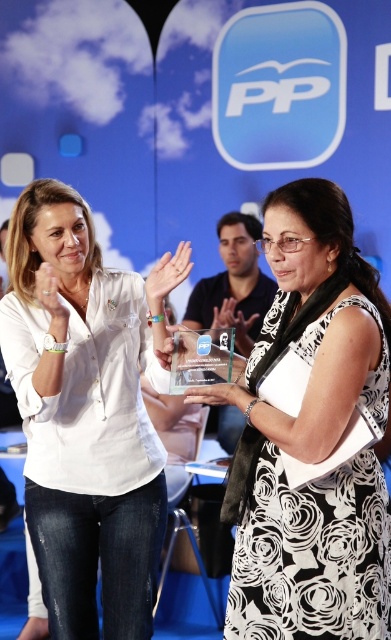
Based on the photo, does black and white floral dress at center have a lesser width compared to matte plastic award at center?

In fact, black and white floral dress at center might be wider than matte plastic award at center.

Between point (367, 401) and point (190, 326), which one is positioned in front?

Point (367, 401) is in front.

At what (x,y) coordinates should I click in order to perform the action: click on black and white floral dress at center. Please return your answer as a coordinate pair (x, y). The height and width of the screenshot is (640, 391). Looking at the image, I should click on (310, 436).

Consider the image. Between black and white floral dress at center and matte white hand at center, which one is positioned lower?

black and white floral dress at center is lower down.

Does black and white floral dress at center come behind matte white hand at center?

No, black and white floral dress at center is in front of matte white hand at center.

Is point (306, 608) closer to camera compared to point (168, 275)?

Yes, point (306, 608) is closer to viewer.

You are a GUI agent. You are given a task and a screenshot of the screen. Output one action in this format:
    pyautogui.click(x=<x>, y=<y>)
    Task: Click on the black and white floral dress at center
    The height and width of the screenshot is (640, 391).
    Given the screenshot: What is the action you would take?
    [310, 436]

Is matte white hand at center wider than matte plastic award at center?

Yes, matte white hand at center is wider than matte plastic award at center.

Does point (170, 260) lie in front of point (165, 353)?

No, (170, 260) is further to viewer.

At what (x,y) coordinates should I click in order to perform the action: click on matte white hand at center. Please return your answer as a coordinate pair (x, y). The image size is (391, 640). Looking at the image, I should click on (168, 272).